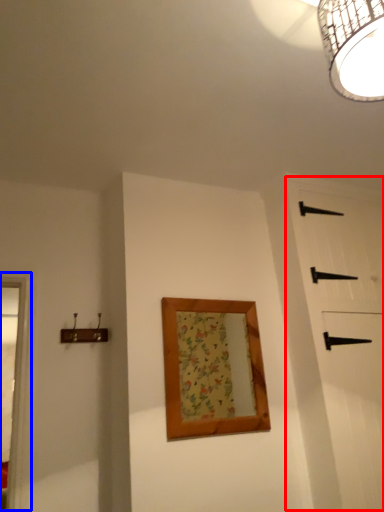
Question: Which object is closer to the camera taking this photo, barn door (highlighted by a red box) or window frame (highlighted by a blue box)?

Choices:
 (A) barn door
 (B) window frame

Answer: (B)